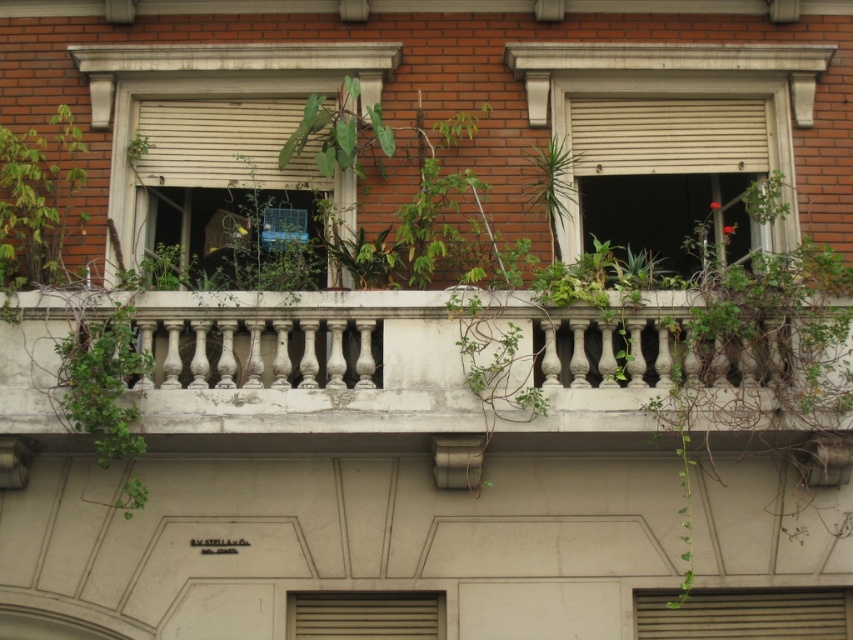
Question: Is matte white window at center above metallic gray window at lower center?

Choices:
 (A) no
 (B) yes

Answer: (B)

Question: Which object is positioned closest to the green leafy plant at left?

Choices:
 (A) white matte window at upper right
 (B) matte gray vent at center
 (C) white stone railing at center

Answer: (C)

Question: Among these points, which one is nearest to the camera?

Choices:
 (A) (254, 65)
 (B) (709, 116)
 (C) (387, 604)
 (D) (173, 360)

Answer: (D)

Question: Is white matte window at upper right closer to camera compared to metallic gray window at lower center?

Choices:
 (A) no
 (B) yes

Answer: (A)

Question: Is white stone railing at center wider than matte white window at center?

Choices:
 (A) no
 (B) yes

Answer: (B)

Question: Among these objects, which one is farthest from the camera?

Choices:
 (A) matte white window at center
 (B) matte gray vent at center
 (C) green leafy plant at left
 (D) white stone railing at center

Answer: (A)